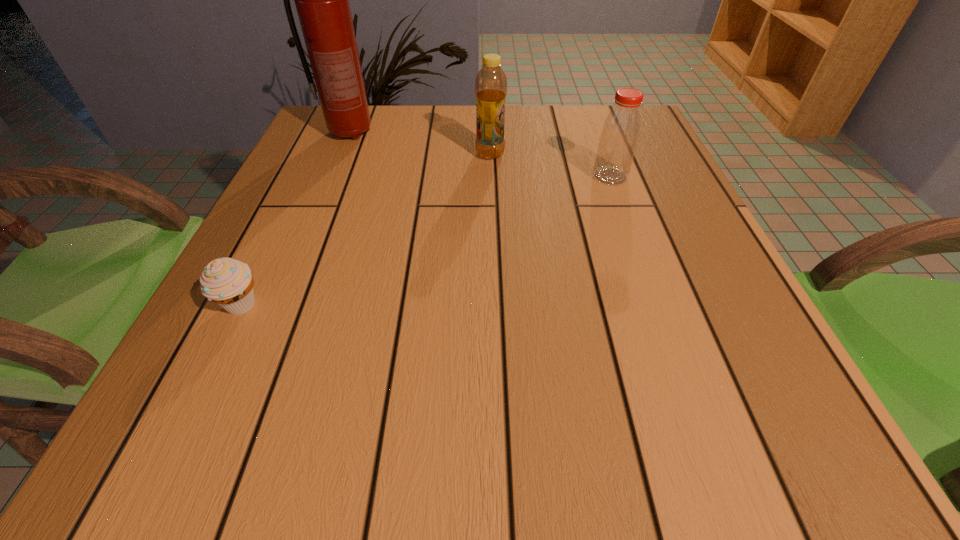
This screenshot has height=540, width=960. I want to click on the tallest object, so click(322, 0).

You are a GUI agent. You are given a task and a screenshot of the screen. Output one action in this format:
    pyautogui.click(x=<x>, y=<y>)
    Task: Click on the fire extinguisher
    The height and width of the screenshot is (540, 960).
    Given the screenshot: What is the action you would take?
    pyautogui.click(x=322, y=0)

In order to click on the third shortest object in this screenshot , I will do `click(491, 83)`.

Identify the location of the third object from left to right. Image resolution: width=960 pixels, height=540 pixels. (491, 83).

Find the location of a particular element. the third tallest object is located at coordinates (621, 129).

At what (x,y) coordinates should I click in order to perform the action: click on the right bottle. Please return your answer as a coordinate pair (x, y). This screenshot has height=540, width=960. Looking at the image, I should click on (621, 129).

The image size is (960, 540). Find the location of `muffin`. muffin is located at coordinates (228, 282).

Image resolution: width=960 pixels, height=540 pixels. I want to click on the shortest object, so pos(228,282).

Where is `vacant space located on the handle side the farthest object`? The width and height of the screenshot is (960, 540). vacant space located on the handle side the farthest object is located at coordinates (497, 133).

Find the location of a particular element. vacant space located on the front of the taller bottle is located at coordinates (491, 191).